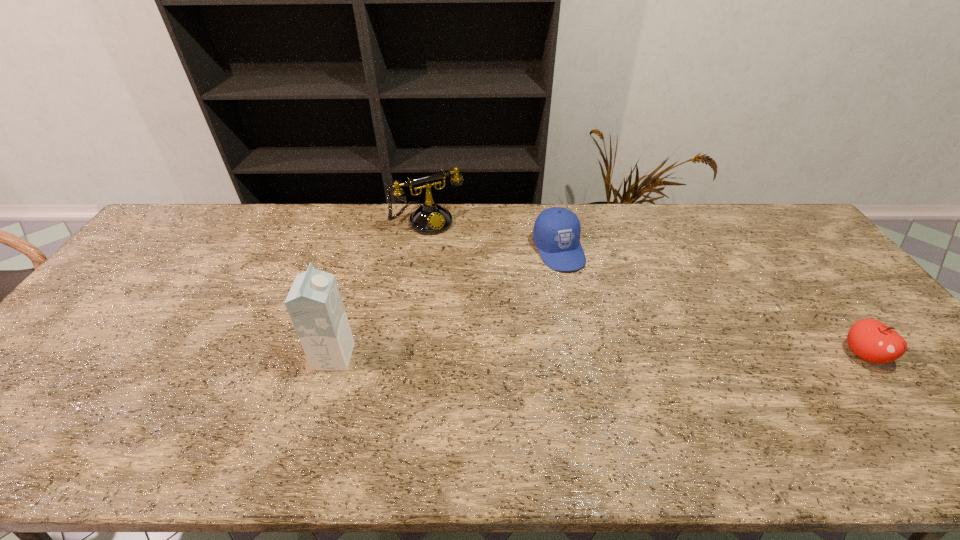
This screenshot has height=540, width=960. What are the coordinates of `free space between the rightmost object and the second object from left to right` in the screenshot? It's located at (646, 287).

Where is `vacant point located between the cap and the rightmost object`? The image size is (960, 540). vacant point located between the cap and the rightmost object is located at coordinates (711, 302).

Find the location of `the third closest object to the rightmost object`. the third closest object to the rightmost object is located at coordinates (314, 303).

Image resolution: width=960 pixels, height=540 pixels. Identify the location of object that is the closest to the third object from left to right. (430, 218).

This screenshot has height=540, width=960. I want to click on blank area in the image that satisfies the following two spatial constraints: 1. on the front side of the third object from left to right; 2. on the left side of the telephone, so click(424, 251).